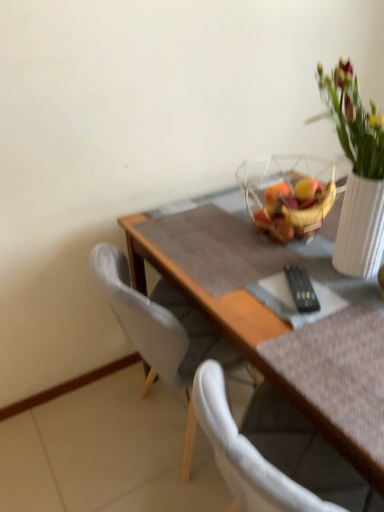
Question: From the image's perspective, is white fabric chair at left beneath translucent glass bowl at upper center?

Choices:
 (A) yes
 (B) no

Answer: (A)

Question: Could you tell me if white fabric chair at left is turned towards translucent glass bowl at upper center?

Choices:
 (A) yes
 (B) no

Answer: (B)

Question: Is white fabric chair at left bigger than translucent glass bowl at upper center?

Choices:
 (A) yes
 (B) no

Answer: (A)

Question: Are white fabric chair at left and translucent glass bowl at upper center making contact?

Choices:
 (A) yes
 (B) no

Answer: (B)

Question: From the image's perspective, is white fabric chair at left on translucent glass bowl at upper center?

Choices:
 (A) yes
 (B) no

Answer: (B)

Question: Is translucent glass bowl at upper center completely or partially inside white fabric chair at left?

Choices:
 (A) no
 (B) yes

Answer: (A)

Question: Is transparent glass bowl at upper right looking in the opposite direction of wooden table at center?

Choices:
 (A) no
 (B) yes

Answer: (A)

Question: Considering the relative sizes of transparent glass bowl at upper right and wooden table at center in the image provided, is transparent glass bowl at upper right taller than wooden table at center?

Choices:
 (A) yes
 (B) no

Answer: (B)

Question: Are transparent glass bowl at upper right and wooden table at center located far from each other?

Choices:
 (A) yes
 (B) no

Answer: (B)

Question: From the image's perspective, would you say transparent glass bowl at upper right is positioned over wooden table at center?

Choices:
 (A) no
 (B) yes

Answer: (B)

Question: Does transparent glass bowl at upper right have a lesser width compared to wooden table at center?

Choices:
 (A) no
 (B) yes

Answer: (B)

Question: Is transparent glass bowl at upper right shorter than wooden table at center?

Choices:
 (A) no
 (B) yes

Answer: (B)

Question: Considering the relative sizes of translucent glass bowl at upper center and transparent glass bowl at upper right in the image provided, is translucent glass bowl at upper center bigger than transparent glass bowl at upper right?

Choices:
 (A) yes
 (B) no

Answer: (B)